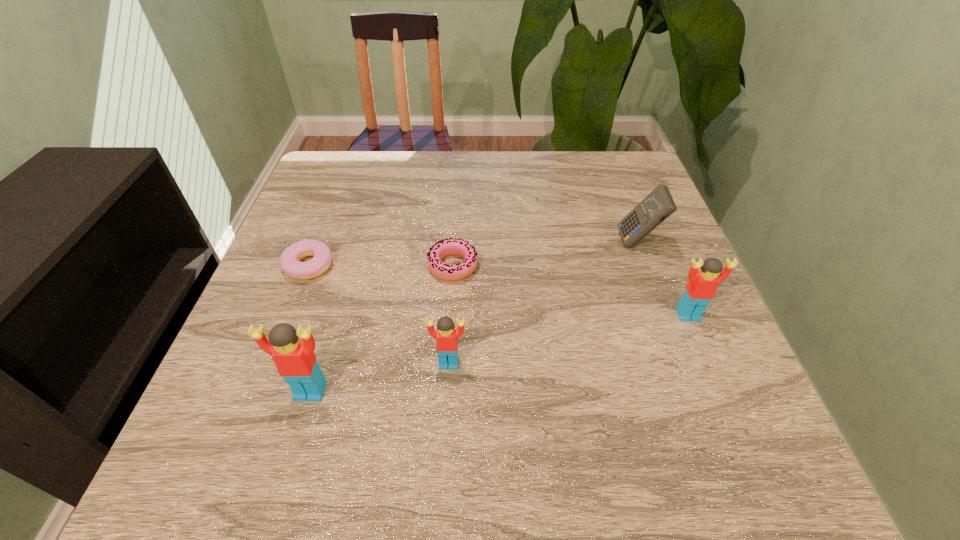
Find the location of a particular element. This screenshot has height=540, width=960. free space that satisfies the following two spatial constraints: 1. on the front-facing side of the calculator; 2. on the face of the second farthest Lego is located at coordinates (683, 363).